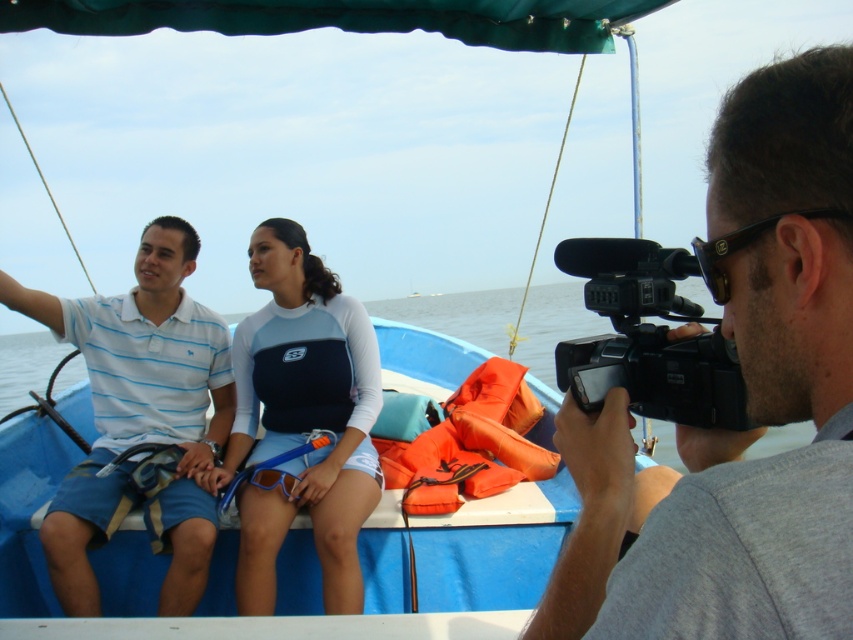
Does gray matte camera at right have a lesser height compared to black plastic video camera at right?

No, gray matte camera at right is not shorter than black plastic video camera at right.

Can you confirm if gray matte camera at right is wider than black plastic video camera at right?

Yes, gray matte camera at right is wider than black plastic video camera at right.

Who is more forward, (755,476) or (692,420)?

Point (755,476) is in front.

Where is `gray matte camera at right`? gray matte camera at right is located at coordinates (747, 400).

Between blue neoprene wetsuit at center and orange fabric life jacket at center, which one has more height?

blue neoprene wetsuit at center

Does blue neoprene wetsuit at center have a smaller size compared to orange fabric life jacket at center?

No.

Where is `blue neoprene wetsuit at center`? blue neoprene wetsuit at center is located at coordinates (302, 419).

Where is `blue neoprene wetsuit at center`? The width and height of the screenshot is (853, 640). blue neoprene wetsuit at center is located at coordinates (302, 419).

Which is in front, point (677, 632) or point (482, 410)?

Point (677, 632) is in front.

What do you see at coordinates (747, 400) in the screenshot? I see `gray matte camera at right` at bounding box center [747, 400].

You are a GUI agent. You are given a task and a screenshot of the screen. Output one action in this format:
    pyautogui.click(x=<x>, y=<y>)
    Task: Click on the gray matte camera at right
    This screenshot has width=853, height=640.
    Given the screenshot: What is the action you would take?
    pyautogui.click(x=747, y=400)